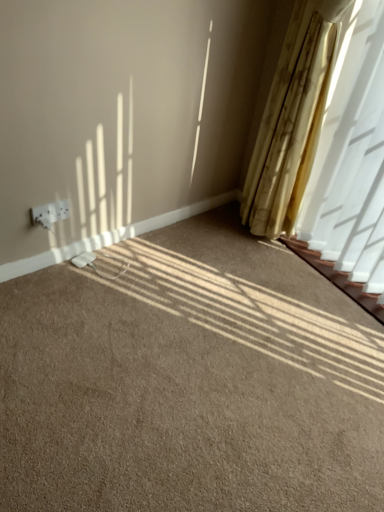
Question: Is brown carpet at center wider than white plastic outlet at lower left?

Choices:
 (A) yes
 (B) no

Answer: (A)

Question: Does brown carpet at center lie behind white plastic outlet at lower left?

Choices:
 (A) no
 (B) yes

Answer: (A)

Question: Does brown carpet at center come in front of white plastic outlet at lower left?

Choices:
 (A) no
 (B) yes

Answer: (B)

Question: Does brown carpet at center have a smaller size compared to white plastic outlet at lower left?

Choices:
 (A) yes
 (B) no

Answer: (B)

Question: Considering the relative sizes of brown carpet at center and white plastic outlet at lower left in the image provided, is brown carpet at center thinner than white plastic outlet at lower left?

Choices:
 (A) no
 (B) yes

Answer: (A)

Question: Can you see brown carpet at center touching white plastic outlet at lower left?

Choices:
 (A) no
 (B) yes

Answer: (A)

Question: Is yellow textured curtain at right positioned before white plastic outlet at lower left?

Choices:
 (A) yes
 (B) no

Answer: (A)

Question: Does yellow textured curtain at right have a smaller size compared to white plastic outlet at lower left?

Choices:
 (A) yes
 (B) no

Answer: (B)

Question: Does yellow textured curtain at right have a greater width compared to white plastic outlet at lower left?

Choices:
 (A) no
 (B) yes

Answer: (B)

Question: Considering the relative sizes of yellow textured curtain at right and white plastic outlet at lower left in the image provided, is yellow textured curtain at right taller than white plastic outlet at lower left?

Choices:
 (A) yes
 (B) no

Answer: (A)

Question: From the image's perspective, does yellow textured curtain at right appear lower than white plastic outlet at lower left?

Choices:
 (A) no
 (B) yes

Answer: (A)

Question: Is yellow textured curtain at right positioned behind white plastic outlet at lower left?

Choices:
 (A) yes
 (B) no

Answer: (B)

Question: From the image's perspective, is yellow textured curtain at right over brown carpet at center?

Choices:
 (A) no
 (B) yes

Answer: (B)